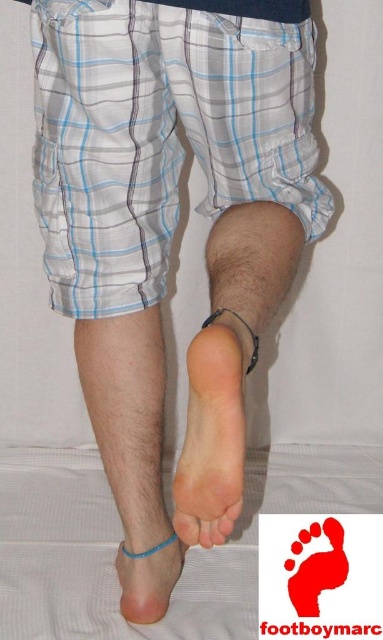
Question: Does skinny white leg at center have a greater width compared to transparent blue toe at lower center?

Choices:
 (A) no
 (B) yes

Answer: (B)

Question: Which point is farther to the camera?

Choices:
 (A) (132, 572)
 (B) (196, 524)
 (C) (214, 310)
 (D) (217, 518)

Answer: (A)

Question: Is skinny white leg at center above pink smooth foot at center?

Choices:
 (A) no
 (B) yes

Answer: (B)

Question: Which object appears closest to the camera in this image?

Choices:
 (A) pink smooth foot at center
 (B) white plaid shorts at lower left

Answer: (A)

Question: Is the position of pink smooth foot at center more distant than that of transparent blue toe at lower center?

Choices:
 (A) no
 (B) yes

Answer: (A)

Question: Which object is the farthest from the pink matte toe at center?

Choices:
 (A) blue rubber anklet at lower center
 (B) skinny white leg at center

Answer: (A)